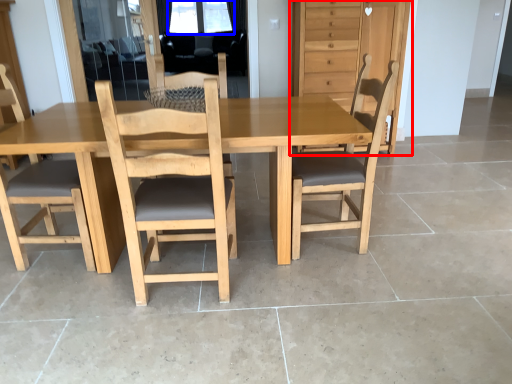
Question: Which object appears closest to the camera in this image, dresser (highlighted by a red box) or window screen (highlighted by a blue box)?

Choices:
 (A) dresser
 (B) window screen

Answer: (A)